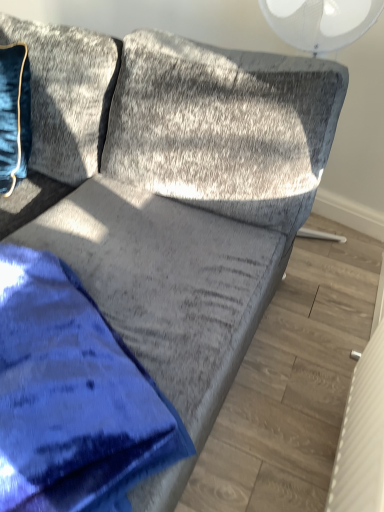
At what (x,y) coordinates should I click in order to perform the action: click on velvet blue blanket at lower left. Please return your answer as a coordinate pair (x, y). The width and height of the screenshot is (384, 512). Looking at the image, I should click on (72, 397).

Describe the element at coordinates (72, 397) in the screenshot. The width and height of the screenshot is (384, 512). I see `velvet blue blanket at lower left` at that location.

Find the location of a particular element. The width and height of the screenshot is (384, 512). velvet blue blanket at lower left is located at coordinates (72, 397).